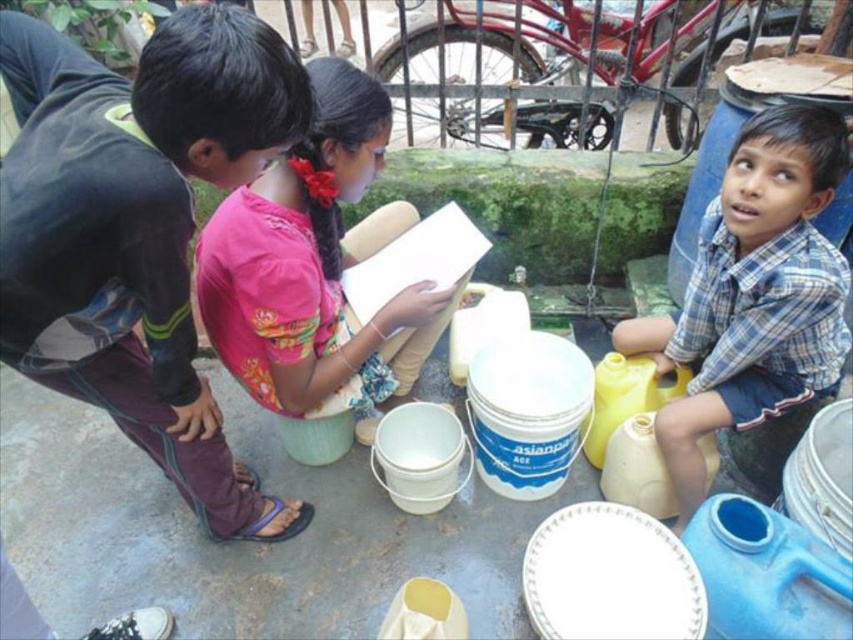
From the picture: Does dark purple pants at left appear under pink fabric shirt at center?

Indeed, dark purple pants at left is positioned under pink fabric shirt at center.

Who is lower down, dark purple pants at left or pink fabric shirt at center?

dark purple pants at left

Does point (4, 344) come behind point (413, 284)?

No, it is in front of (413, 284).

Locate an element on the screen. This screenshot has height=640, width=853. dark purple pants at left is located at coordinates (136, 228).

Is point (184, 17) farther from viewer compared to point (730, 284)?

No.

Locate an element on the screen. The width and height of the screenshot is (853, 640). dark purple pants at left is located at coordinates (136, 228).

Does pink fabric shirt at center appear over blue plaid shirt at center?

Indeed, pink fabric shirt at center is positioned over blue plaid shirt at center.

From the picture: Which is more to the right, pink fabric shirt at center or blue plaid shirt at center?

blue plaid shirt at center

Where is `pink fabric shirt at center`? The width and height of the screenshot is (853, 640). pink fabric shirt at center is located at coordinates [x=314, y=264].

Identify the location of pink fabric shirt at center. (314, 264).